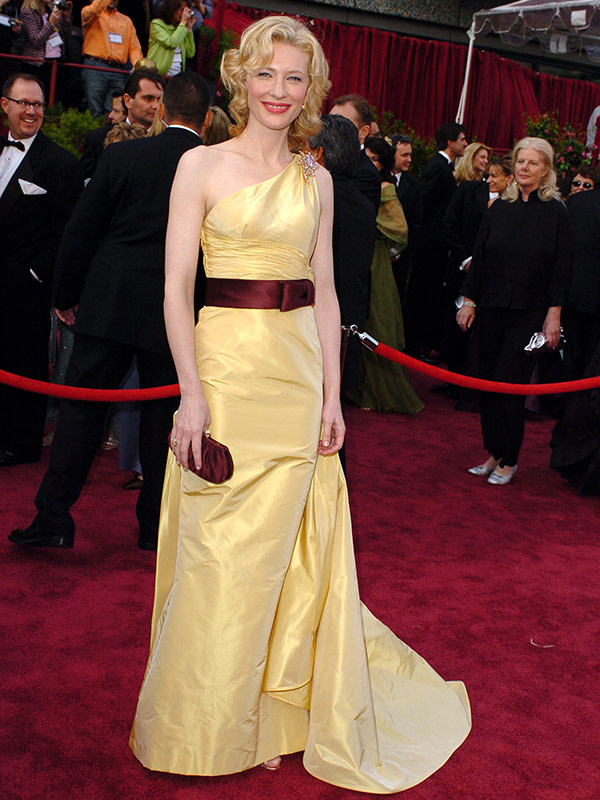
Where is `rug`? rug is located at coordinates (492, 630).